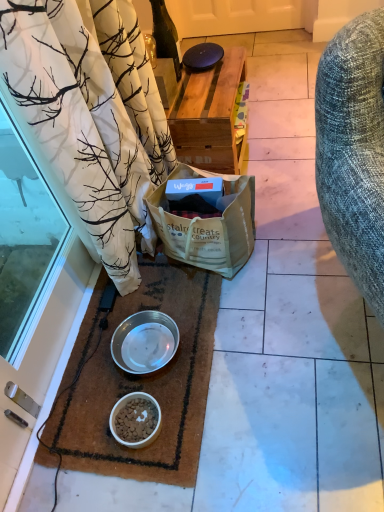
This screenshot has height=512, width=384. I want to click on vacant area situated to the left side of white matte bowl at lower center, which is the 2th bowl from top to bottom, so click(x=79, y=432).